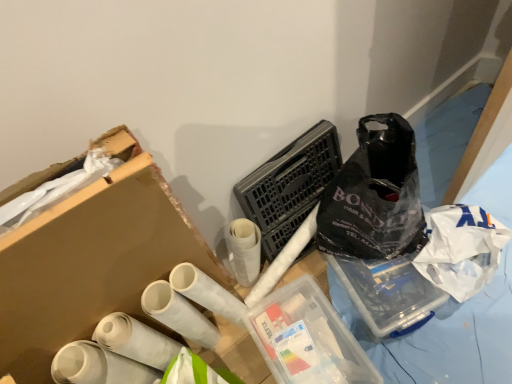
You are a GUI agent. You are given a task and a screenshot of the screen. Output one action in this format:
    pyautogui.click(x=<x>, y=<y>)
    Task: Click on the white matte toilet paper at lower left, positioned as the first toilet paper in left-to-right order
    This screenshot has width=512, height=384.
    Given the screenshot: What is the action you would take?
    pyautogui.click(x=98, y=366)

Describe the element at coordinates (178, 314) in the screenshot. This screenshot has height=384, width=512. I see `white glossy toilet paper at center, which appears as the first toilet paper when viewed from the right` at that location.

From the picture: How much space does white glossy toilet paper at center, which appears as the first toilet paper when viewed from the right, occupy horizontally?

white glossy toilet paper at center, which appears as the first toilet paper when viewed from the right, is 4.00 inches wide.

You are a GUI agent. You are given a task and a screenshot of the screen. Output one action in this format:
    pyautogui.click(x=<x>, y=<y>)
    Task: Click on the white matte toilet paper at lower left, the 3th toilet paper when ordered from right to left
    
    Given the screenshot: What is the action you would take?
    pyautogui.click(x=98, y=366)

Between black plastic laundry basket at center and white matte toilet paper at lower left, the 3th toilet paper when ordered from right to left, which one has larger size?

Bigger between the two is black plastic laundry basket at center.

Measure the distance between black plastic laundry basket at center and white matte toilet paper at lower left, positioned as the first toilet paper in left-to-right order.

black plastic laundry basket at center is 24.48 inches from white matte toilet paper at lower left, positioned as the first toilet paper in left-to-right order.

Can you confirm if black plastic laundry basket at center is positioned to the right of white matte toilet paper at lower left, the 3th toilet paper when ordered from right to left?

Indeed, black plastic laundry basket at center is positioned on the right side of white matte toilet paper at lower left, the 3th toilet paper when ordered from right to left.

Is the depth of black plastic laundry basket at center less than that of white matte toilet paper at lower left, the 3th toilet paper when ordered from right to left?

No, it is not.

Consider the image. From the image's perspective, between white matte toilet paper at lower left, the 3th toilet paper when ordered from right to left, and white glossy toilet paper at center, which appears as the first toilet paper when viewed from the right, who is located below?

white matte toilet paper at lower left, the 3th toilet paper when ordered from right to left.

Considering the points (68, 370) and (147, 299), which point is in front, point (68, 370) or point (147, 299)?

Positioned in front is point (68, 370).

From a real-world perspective, does white matte toilet paper at lower left, the 3th toilet paper when ordered from right to left, sit lower than white glossy toilet paper at center, which appears as the first toilet paper when viewed from the right?

No.

Consider the image. Is the depth of white matte toilet paper at lower left, which appears as the second toilet paper when viewed from the right, less than that of white matte toilet paper at lower left, the 3th toilet paper when ordered from right to left?

No, white matte toilet paper at lower left, which appears as the second toilet paper when viewed from the right, is behind white matte toilet paper at lower left, the 3th toilet paper when ordered from right to left.

In terms of height, does white matte toilet paper at lower left, which appears as the second toilet paper when viewed from the right, look taller or shorter compared to white matte toilet paper at lower left, the 3th toilet paper when ordered from right to left?

In the image, white matte toilet paper at lower left, which appears as the second toilet paper when viewed from the right, appears to be taller than white matte toilet paper at lower left, the 3th toilet paper when ordered from right to left.

At what (x,y) coordinates should I click in order to perform the action: click on toilet paper that is the 1st one when counting rightward from the white matte toilet paper at lower left, positioned as the first toilet paper in left-to-right order. Please return your answer as a coordinate pair (x, y). The width and height of the screenshot is (512, 384). Looking at the image, I should click on (135, 340).

From the image's perspective, which object appears higher, white matte toilet paper at lower left, the 3th toilet paper when ordered from right to left, or transparent plastic container at center?

white matte toilet paper at lower left, the 3th toilet paper when ordered from right to left, is shown above in the image.

Image resolution: width=512 pixels, height=384 pixels. Identify the location of the 3rd toilet paper counting from the left of the transparent plastic container at center. (98, 366).

From the picture: Considering the relative positions of white matte toilet paper at lower left, positioned as the first toilet paper in left-to-right order, and transparent plastic container at center in the image provided, is white matte toilet paper at lower left, positioned as the first toilet paper in left-to-right order, to the left of transparent plastic container at center from the viewer's perspective?

Yes, white matte toilet paper at lower left, positioned as the first toilet paper in left-to-right order, is to the left of transparent plastic container at center.

Between black plastic laundry basket at center and white matte toilet paper at lower left, which appears as the second toilet paper when viewed from the right, which one has smaller size?

white matte toilet paper at lower left, which appears as the second toilet paper when viewed from the right, is smaller.

Considering the relative positions of black plastic laundry basket at center and white matte toilet paper at lower left, which appears as the second toilet paper when viewed from the right, in the image provided, is black plastic laundry basket at center to the left or to the right of white matte toilet paper at lower left, which appears as the second toilet paper when viewed from the right,?

From the image, it's evident that black plastic laundry basket at center is to the right of white matte toilet paper at lower left, which appears as the second toilet paper when viewed from the right.

Is white matte toilet paper at lower left, the 2th toilet paper from the left, inside black plastic laundry basket at center?

No, white matte toilet paper at lower left, the 2th toilet paper from the left, is located outside of black plastic laundry basket at center.

Locate an element on the screen. The image size is (512, 384). laundry basket that is above the white matte toilet paper at lower left, the 2th toilet paper from the left (from a real-world perspective) is located at coordinates (289, 185).

Is transparent plastic container at center not inside black plastic laundry basket at center?

Absolutely, transparent plastic container at center is external to black plastic laundry basket at center.

Which object is wider, transparent plastic container at center or black plastic laundry basket at center?

transparent plastic container at center is wider.

Considering the relative positions of transparent plastic container at center and black plastic laundry basket at center in the image provided, is transparent plastic container at center to the left of black plastic laundry basket at center from the viewer's perspective?

Incorrect, transparent plastic container at center is not on the left side of black plastic laundry basket at center.

From a real-world perspective, which is physically below, transparent plastic container at center or black plastic laundry basket at center?

transparent plastic container at center, from a real-world perspective.

How different are the orientations of white matte toilet paper at lower left, the 3th toilet paper when ordered from right to left, and white matte toilet paper at lower left, which appears as the second toilet paper when viewed from the right, in degrees?

The angular difference between white matte toilet paper at lower left, the 3th toilet paper when ordered from right to left, and white matte toilet paper at lower left, which appears as the second toilet paper when viewed from the right, is 2.55 degrees.

Is white matte toilet paper at lower left, the 3th toilet paper when ordered from right to left, taller or shorter than white matte toilet paper at lower left, the 2th toilet paper from the left?

Clearly, white matte toilet paper at lower left, the 3th toilet paper when ordered from right to left, is shorter compared to white matte toilet paper at lower left, the 2th toilet paper from the left.

From a real-world perspective, is white matte toilet paper at lower left, the 3th toilet paper when ordered from right to left, beneath white matte toilet paper at lower left, the 2th toilet paper from the left?

Actually, white matte toilet paper at lower left, the 3th toilet paper when ordered from right to left, is physically above white matte toilet paper at lower left, the 2th toilet paper from the left, in the real world.

You are a GUI agent. You are given a task and a screenshot of the screen. Output one action in this format:
    pyautogui.click(x=<x>, y=<y>)
    Task: Click on the toilet paper positioned vertically above the black plastic laundry basket at center (from a real-world perspective)
    The height and width of the screenshot is (384, 512).
    Given the screenshot: What is the action you would take?
    pyautogui.click(x=98, y=366)

I want to click on the 2nd toilet paper positioned above the white matte toilet paper at lower left, the 3th toilet paper when ordered from right to left (from the image's perspective), so click(178, 314).

Estimate the real-world distances between objects in this image. Which object is closer to black plastic laundry basket at center, white glossy toilet paper at center, which appears as the first toilet paper when viewed from the right, or white matte toilet paper at lower left, the 3th toilet paper when ordered from right to left?

white glossy toilet paper at center, which appears as the first toilet paper when viewed from the right, lies closer to black plastic laundry basket at center than the other object.

From the image, which object appears to be farther from white matte toilet paper at lower left, which appears as the second toilet paper when viewed from the right, white matte toilet paper at lower left, the 3th toilet paper when ordered from right to left, or black plastic laundry basket at center?

black plastic laundry basket at center is positioned further to the anchor white matte toilet paper at lower left, which appears as the second toilet paper when viewed from the right.

Estimate the real-world distances between objects in this image. Which object is further from black plastic laundry basket at center, transparent plastic container at center or white glossy toilet paper at center, which appears as the first toilet paper when viewed from the right?

Based on the image, white glossy toilet paper at center, which appears as the first toilet paper when viewed from the right, appears to be further to black plastic laundry basket at center.

From the image, which object appears to be farther from white glossy toilet paper at center, acting as the 3th toilet paper starting from the left, transparent plastic container at center or white matte toilet paper at lower left, positioned as the first toilet paper in left-to-right order?

Based on the image, transparent plastic container at center appears to be further to white glossy toilet paper at center, acting as the 3th toilet paper starting from the left.

Based on their spatial positions, is white glossy toilet paper at center, which appears as the first toilet paper when viewed from the right, or transparent plastic container at center closer to black plastic laundry basket at center?

Among the two, transparent plastic container at center is located nearer to black plastic laundry basket at center.

Which object lies nearer to the anchor point white matte toilet paper at lower left, the 3th toilet paper when ordered from right to left, white matte toilet paper at lower left, the 2th toilet paper from the left, or black plastic laundry basket at center?

The object closer to white matte toilet paper at lower left, the 3th toilet paper when ordered from right to left, is white matte toilet paper at lower left, the 2th toilet paper from the left.

Which object lies nearer to the anchor point white matte toilet paper at lower left, the 2th toilet paper from the left, black plastic laundry basket at center or white matte toilet paper at lower left, positioned as the first toilet paper in left-to-right order?

white matte toilet paper at lower left, positioned as the first toilet paper in left-to-right order, lies closer to white matte toilet paper at lower left, the 2th toilet paper from the left, than the other object.

Looking at the image, which one is located further to white matte toilet paper at lower left, which appears as the second toilet paper when viewed from the right, white glossy toilet paper at center, which appears as the first toilet paper when viewed from the right, or transparent plastic container at center?

transparent plastic container at center lies further to white matte toilet paper at lower left, which appears as the second toilet paper when viewed from the right, than the other object.

The width and height of the screenshot is (512, 384). I want to click on toilet paper located between white matte toilet paper at lower left, positioned as the first toilet paper in left-to-right order, and white glossy toilet paper at center, acting as the 3th toilet paper starting from the left, in the left-right direction, so click(135, 340).

The height and width of the screenshot is (384, 512). I want to click on toilet paper between white matte toilet paper at lower left, the 2th toilet paper from the left, and transparent plastic container at center, so click(x=178, y=314).

I want to click on toilet paper between black plastic laundry basket at center and white matte toilet paper at lower left, the 2th toilet paper from the left, from top to bottom, so click(x=178, y=314).